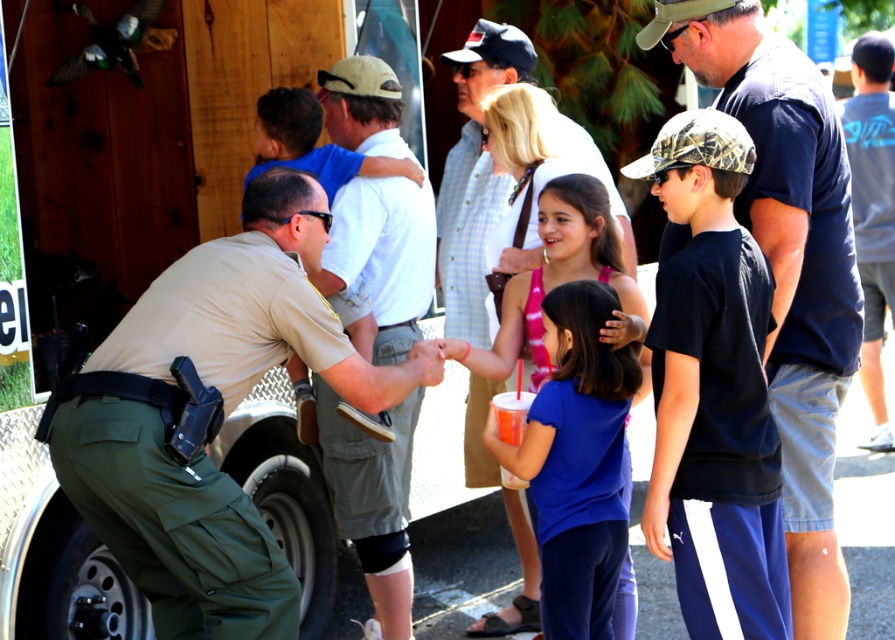
Who is taller, tan uniform at center or dark blue t-shirt at center?

With more height is dark blue t-shirt at center.

Is point (125, 420) less distant than point (789, 568)?

Yes, point (125, 420) is in front of point (789, 568).

Where is `tan uniform at center`? tan uniform at center is located at coordinates (211, 413).

Locate an element on the screen. tan uniform at center is located at coordinates (211, 413).

Between tan uniform at center and khaki cotton shirt at center, which one is positioned higher?

khaki cotton shirt at center is higher up.

Who is positioned more to the left, tan uniform at center or khaki cotton shirt at center?

tan uniform at center

The image size is (895, 640). What are the coordinates of `tan uniform at center` in the screenshot? It's located at (211, 413).

The height and width of the screenshot is (640, 895). I want to click on blue cotton shirt at center, so click(563, 276).

Is blue cotton shirt at center wider than gray cotton t-shirt at right?

Yes.

Between point (624, 284) and point (884, 240), which one is positioned in front?

Positioned in front is point (624, 284).

This screenshot has height=640, width=895. Identify the location of blue cotton shirt at center. (563, 276).